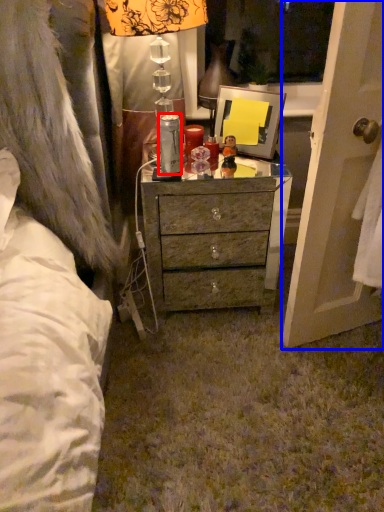
Question: Among these objects, which one is farthest to the camera, bottle (highlighted by a red box) or screen door (highlighted by a blue box)?

Choices:
 (A) bottle
 (B) screen door

Answer: (A)